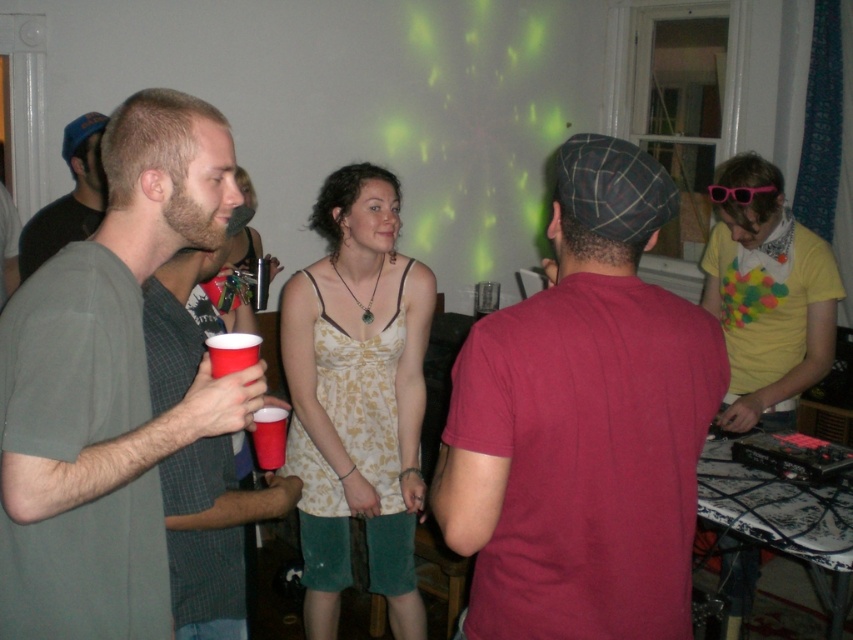
Question: Among these points, which one is nearest to the camera?

Choices:
 (A) (639, 602)
 (B) (405, 465)
 (C) (76, 234)
 (D) (708, 186)

Answer: (A)

Question: Does yellow matte shirt at right appear over matte plastic cup at left?

Choices:
 (A) no
 (B) yes

Answer: (B)

Question: Can you confirm if matte red t-shirt at center is wider than matte floral dress at center?

Choices:
 (A) no
 (B) yes

Answer: (B)

Question: Estimate the real-world distances between objects in this image. Which object is closer to the matte red t-shirt at center?

Choices:
 (A) matte gray shirt at left
 (B) yellow matte shirt at right
 (C) matte green t-shirt at left
 (D) matte floral dress at center

Answer: (C)

Question: Among these objects, which one is nearest to the camera?

Choices:
 (A) yellow matte shirt at right
 (B) matte green t-shirt at left
 (C) pink plastic goggles at upper right
 (D) matte plastic cup at lower left

Answer: (B)

Question: Does yellow matte shirt at right appear on the right side of matte plastic cup at lower left?

Choices:
 (A) no
 (B) yes

Answer: (B)